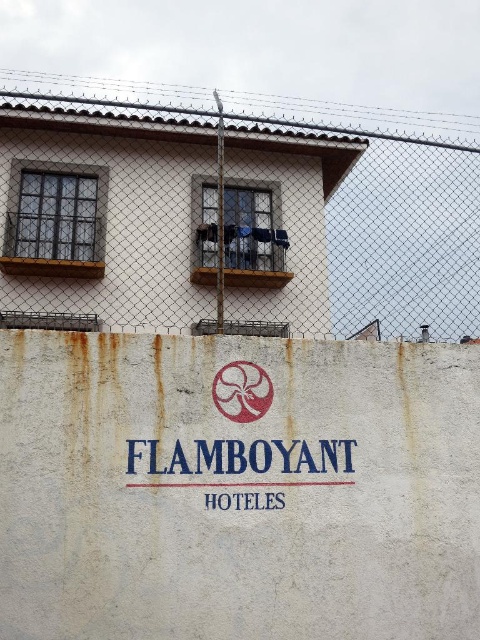
Question: Does wire mesh fence at upper center have a smaller size compared to red matte flower at center?

Choices:
 (A) yes
 (B) no

Answer: (B)

Question: Estimate the real-world distances between objects in this image. Which object is closer to the wire mesh fence at upper center?

Choices:
 (A) white matte sign at center
 (B) red matte flower at center

Answer: (B)

Question: Which point is farther to the camera?

Choices:
 (A) (181, 202)
 (B) (225, 380)

Answer: (A)

Question: Which point appears farthest from the camera in this image?

Choices:
 (A) (220, 397)
 (B) (236, 499)
 (C) (85, 321)

Answer: (C)

Question: Is red matte flower at center positioned at the back of white matte sign at center?

Choices:
 (A) no
 (B) yes

Answer: (B)

Question: Can you confirm if red matte flower at center is wider than white matte sign at center?

Choices:
 (A) no
 (B) yes

Answer: (A)